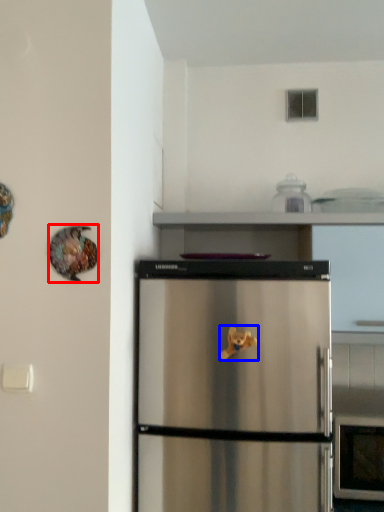
Question: Among these objects, which one is nearest to the camera, animal (highlighted by a red box) or toy (highlighted by a blue box)?

Choices:
 (A) animal
 (B) toy

Answer: (A)